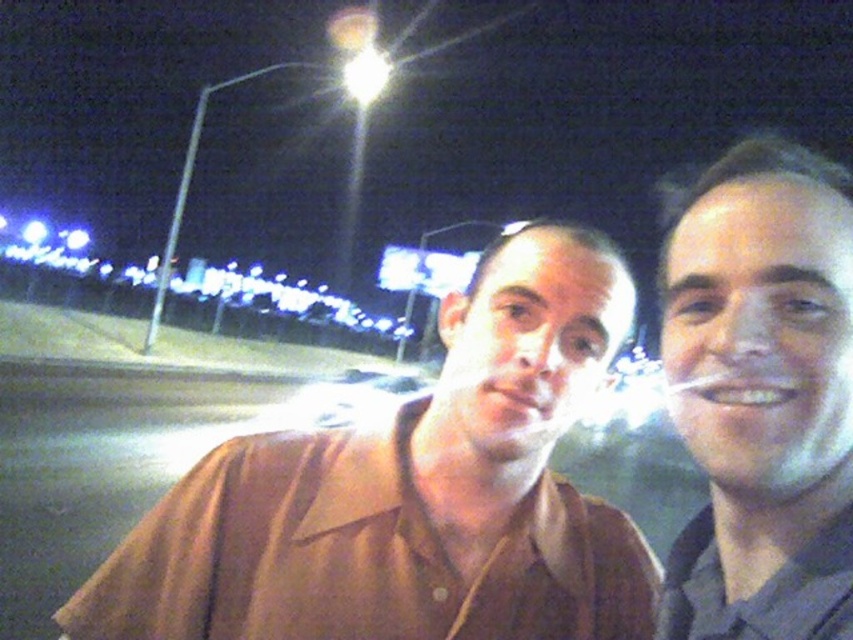
Question: Does brown shirt at center appear over gray matte face at right?

Choices:
 (A) yes
 (B) no

Answer: (B)

Question: Can you confirm if brown shirt at center is positioned above gray matte face at right?

Choices:
 (A) no
 (B) yes

Answer: (A)

Question: Which point is closer to the camera?

Choices:
 (A) gray matte face at right
 (B) brown shirt at center

Answer: (A)

Question: Can you confirm if brown shirt at center is positioned to the left of gray matte face at right?

Choices:
 (A) yes
 (B) no

Answer: (A)